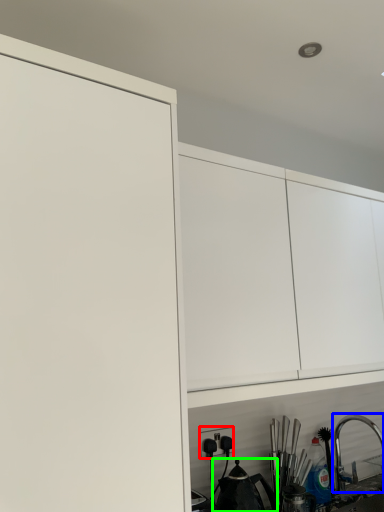
Question: Considering the real-world distances, which object is closest to electric outlet (highlighted by a red box)? tap (highlighted by a blue box) or tea pot (highlighted by a green box).

Choices:
 (A) tap
 (B) tea pot

Answer: (B)